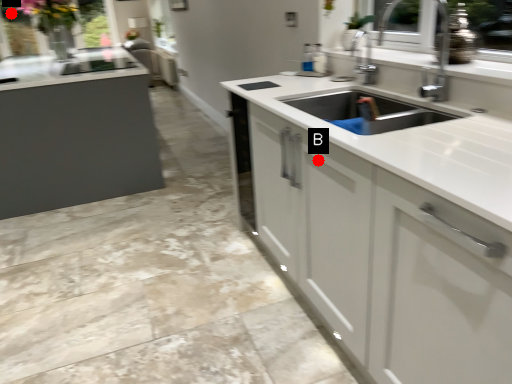
Question: Two points are circled on the image, labeled by A and B beside each circle. Which of the following is the closest to the observer?

Choices:
 (A) A is closer
 (B) B is closer

Answer: (B)